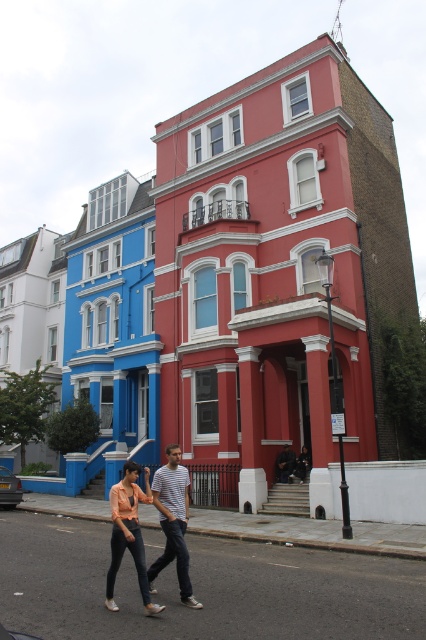
Can you confirm if striped cotton shirt at center is wider than matte peach blouse at center?

In fact, striped cotton shirt at center might be narrower than matte peach blouse at center.

Is point (183, 561) more distant than point (120, 547)?

That is True.

You are a GUI agent. You are given a task and a screenshot of the screen. Output one action in this format:
    pyautogui.click(x=<x>, y=<y>)
    Task: Click on the striped cotton shirt at center
    
    Given the screenshot: What is the action you would take?
    pyautogui.click(x=172, y=522)

Does striped cotton shirt at center have a greater height compared to dark gray fabric jacket at center?

Correct, striped cotton shirt at center is much taller as dark gray fabric jacket at center.

Does striped cotton shirt at center have a smaller size compared to dark gray fabric jacket at center?

Incorrect, striped cotton shirt at center is not smaller in size than dark gray fabric jacket at center.

The image size is (426, 640). Describe the element at coordinates (172, 522) in the screenshot. I see `striped cotton shirt at center` at that location.

Locate an element on the screen. striped cotton shirt at center is located at coordinates (172, 522).

Between matte peach blouse at center and dark gray fabric jacket at center, which one is positioned lower?

Positioned lower is dark gray fabric jacket at center.

Does matte peach blouse at center have a greater height compared to dark gray fabric jacket at center?

Correct, matte peach blouse at center is much taller as dark gray fabric jacket at center.

Which is in front, point (150, 500) or point (279, 458)?

Positioned in front is point (150, 500).

You are a GUI agent. You are given a task and a screenshot of the screen. Output one action in this format:
    pyautogui.click(x=<x>, y=<y>)
    Task: Click on the matte peach blouse at center
    Image resolution: width=426 pixels, height=640 pixels.
    Given the screenshot: What is the action you would take?
    (129, 532)